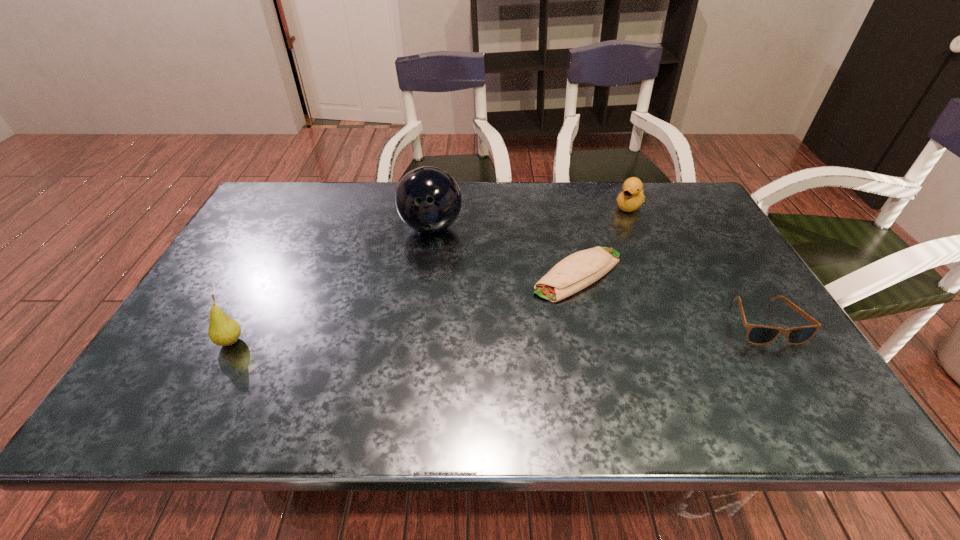
Locate an element on the screen. This screenshot has width=960, height=540. vacant space located 0.080m on the back of the leftmost object is located at coordinates (250, 306).

Find the location of `free space located 0.070m on the frames of the fourth tallest object`. free space located 0.070m on the frames of the fourth tallest object is located at coordinates (794, 371).

The width and height of the screenshot is (960, 540). Find the location of `free location located on the side of the bowling ball with the finger holes`. free location located on the side of the bowling ball with the finger holes is located at coordinates (442, 301).

Where is `free point located on the side of the bowling ball with the finger holes`? free point located on the side of the bowling ball with the finger holes is located at coordinates (437, 269).

The height and width of the screenshot is (540, 960). What are the coordinates of `vacant space located 0.320m on the side of the bowling ball with the finger holes` in the screenshot? It's located at (446, 332).

The image size is (960, 540). Find the location of `vacant point located 0.270m facing forward on the duckling`. vacant point located 0.270m facing forward on the duckling is located at coordinates (588, 260).

Locate an element on the screen. Image resolution: width=960 pixels, height=540 pixels. vacant space located facing forward on the duckling is located at coordinates 585,264.

Locate an element on the screen. Image resolution: width=960 pixels, height=540 pixels. blank space located 0.300m facing forward on the duckling is located at coordinates (584, 266).

The image size is (960, 540). What are the coordinates of `vacant space located at the bitten end of the burrito` in the screenshot? It's located at (496, 321).

The image size is (960, 540). In order to click on free spot located 0.230m at the bitten end of the burrito in this screenshot , I will do `click(473, 336)`.